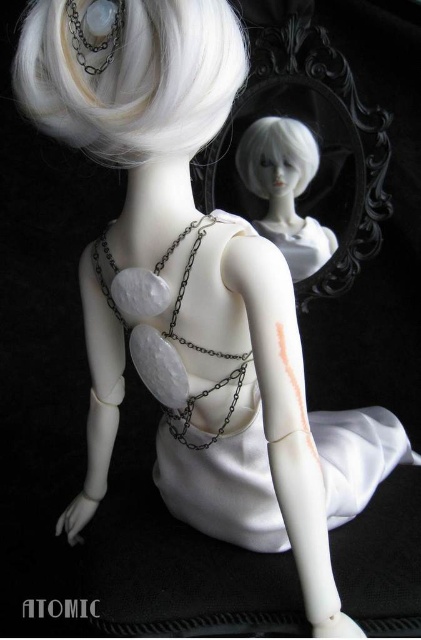
You are an artist trying to paint the doll in the image. You need to place a highlight on the point at coordinate (130, 74). Which part of the doll should you apply the highlight to?

The point at coordinate (130, 74) is on the white matte wig at upper left, so you should apply the highlight to the white matte wig at upper left.

You are a fashion designer examining the doll. You need to determine if the white matte wig at upper left can fit into the storage compartment designed for the white matte dress at center. Based on their sizes, what do you think?

The white matte dress at center is larger in size than the white matte wig at upper left, so the wig can fit into the compartment designed for the dress.

You are an artist trying to sketch this doll. You notice the matte silver chain at center and the white matte doll head at upper center. Which object is located lower in the image?

The matte silver chain at center is positioned under the white matte doll head at upper center, so it is located lower in the image.